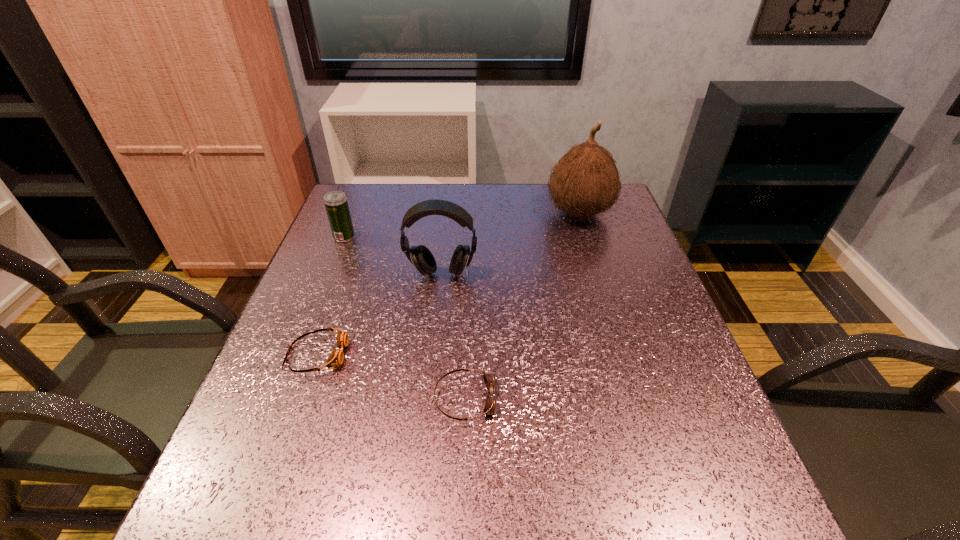
At what (x,y) coordinates should I click in order to perform the action: click on free space located on the ear cups of the fourth shortest object. Please return your answer as a coordinate pair (x, y). Looking at the image, I should click on (436, 325).

The image size is (960, 540). I want to click on vacant region located on the right of the third tallest object, so click(x=403, y=237).

You are a GUI agent. You are given a task and a screenshot of the screen. Output one action in this format:
    pyautogui.click(x=<x>, y=<y>)
    Task: Click on the vacant space located 0.230m with the lenses facing forward on the left goggles
    
    Given the screenshot: What is the action you would take?
    pyautogui.click(x=461, y=354)

Where is `blank space located through the lenses of the right goggles`? blank space located through the lenses of the right goggles is located at coordinates [681, 399].

Where is `object that is at the far edge`? object that is at the far edge is located at coordinates (585, 182).

Where is `beer can that is positioned at the left edge`? This screenshot has height=540, width=960. beer can that is positioned at the left edge is located at coordinates (336, 204).

Where is `goggles that is at the left edge`? The width and height of the screenshot is (960, 540). goggles that is at the left edge is located at coordinates (336, 358).

Locate an element on the screen. Image resolution: width=960 pixels, height=540 pixels. object present at the right edge is located at coordinates (585, 182).

The width and height of the screenshot is (960, 540). What are the coordinates of `object located at the far right corner` in the screenshot? It's located at (585, 182).

Locate an element on the screen. This screenshot has height=540, width=960. vacant space at the far edge of the desktop is located at coordinates (403, 206).